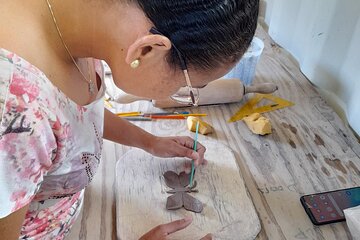
This screenshot has height=240, width=360. I want to click on bench, so click(300, 165).